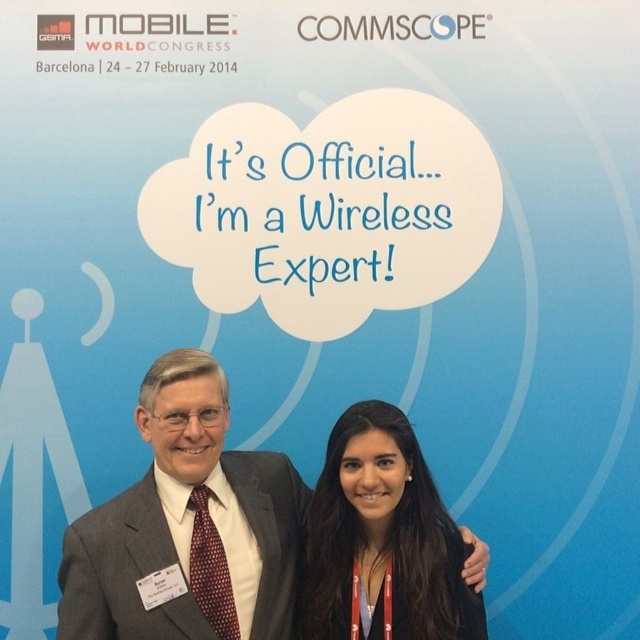
Does gray suit at center appear on the left side of black leather jacket at lower center?

Indeed, gray suit at center is positioned on the left side of black leather jacket at lower center.

The image size is (640, 640). Describe the element at coordinates (188, 525) in the screenshot. I see `gray suit at center` at that location.

Between point (113, 500) and point (413, 637), which one is positioned behind?

Point (113, 500)

Identify the location of gray suit at center. The image size is (640, 640). (188, 525).